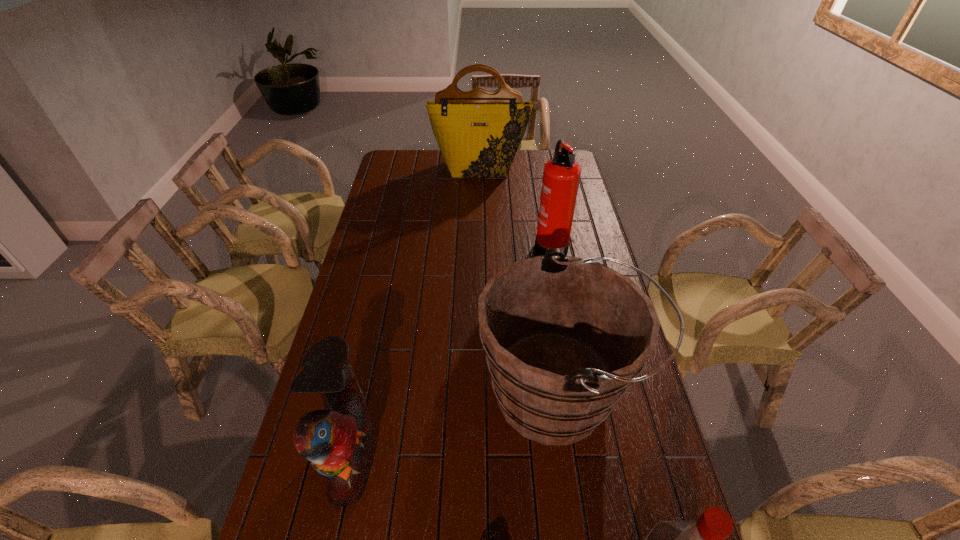
Where is `the farthest object`? the farthest object is located at coordinates (478, 132).

Locate an element on the screen. the second farthest object is located at coordinates (561, 175).

The height and width of the screenshot is (540, 960). What are the coordinates of `bucket` in the screenshot? It's located at (564, 337).

Identify the location of parrot. Image resolution: width=960 pixels, height=540 pixels. (337, 441).

The width and height of the screenshot is (960, 540). Find the location of `vacant space located on the front-facing side of the tote bag`. vacant space located on the front-facing side of the tote bag is located at coordinates (x=479, y=209).

Identify the location of vacant space situated at the nozzle of the fifth nearest object. (498, 242).

In order to click on vacant region located 0.240m at the nozzle of the fifth nearest object in this screenshot , I will do `click(472, 242)`.

Where is `free point located at the nozzle of the fifth nearest object`? This screenshot has height=540, width=960. free point located at the nozzle of the fifth nearest object is located at coordinates (508, 242).

Where is `free space located at the face of the leftmost object`? The image size is (960, 540). free space located at the face of the leftmost object is located at coordinates (468, 457).

Locate an element on the screen. The height and width of the screenshot is (540, 960). object located in the far edge section of the desktop is located at coordinates (478, 132).